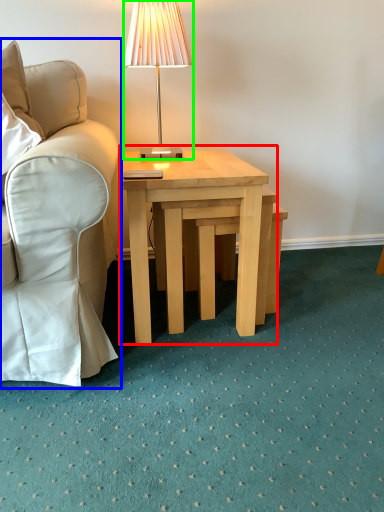
Question: Considering the real-world distances, which object is closest to coffee table (highlighted by a red box)? chair (highlighted by a blue box) or lamp (highlighted by a green box).

Choices:
 (A) chair
 (B) lamp

Answer: (A)